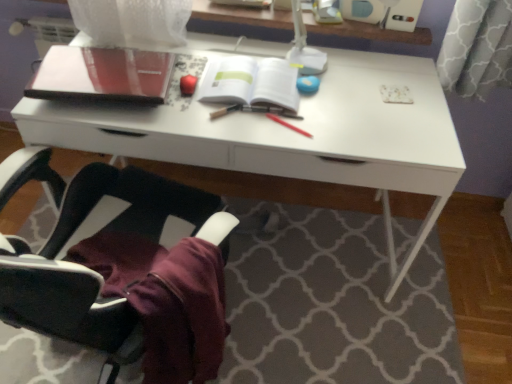
You are a GUI agent. You are given a task and a screenshot of the screen. Output one action in this format:
    pyautogui.click(x=<x>, y=<y>)
    Task: Click on the free space on the front side of glossy red apple at upper center, which ranks as the first stationery in left-to-right order
    
    Given the screenshot: What is the action you would take?
    pyautogui.click(x=184, y=119)